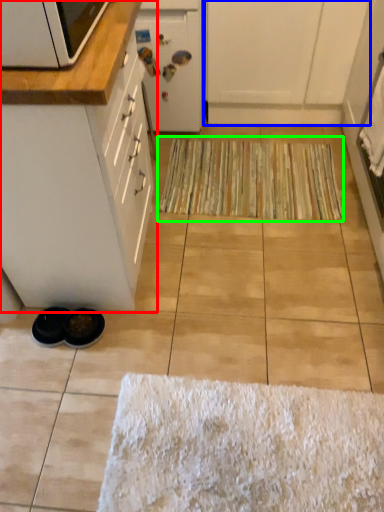
Question: Which object is the closest to the cabinetry (highlighted by a red box)? Choose among these: cabinetry (highlighted by a blue box) or doormat (highlighted by a green box).

Choices:
 (A) cabinetry
 (B) doormat

Answer: (B)